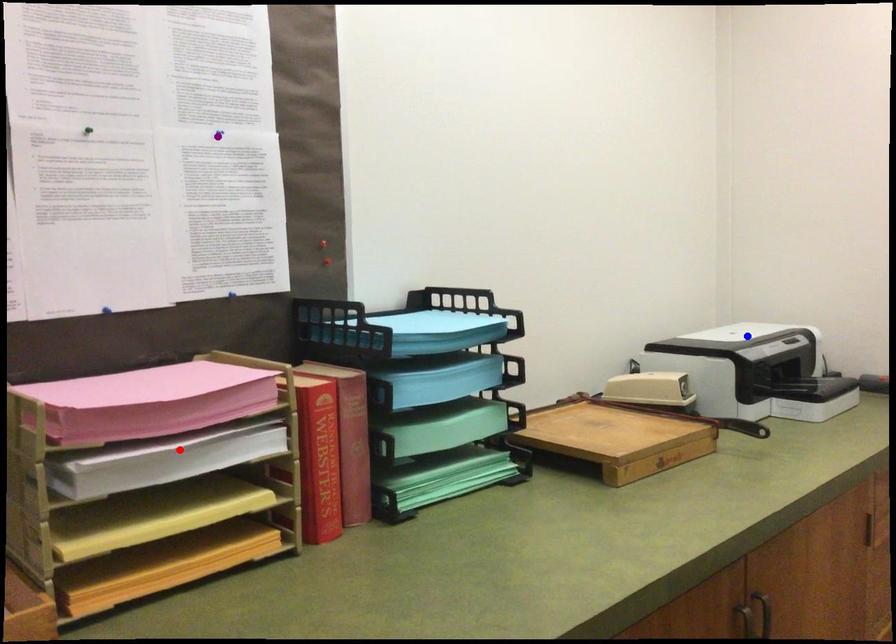
Order these from nearest to farthest:
blue point | purple point | red point

red point → purple point → blue point